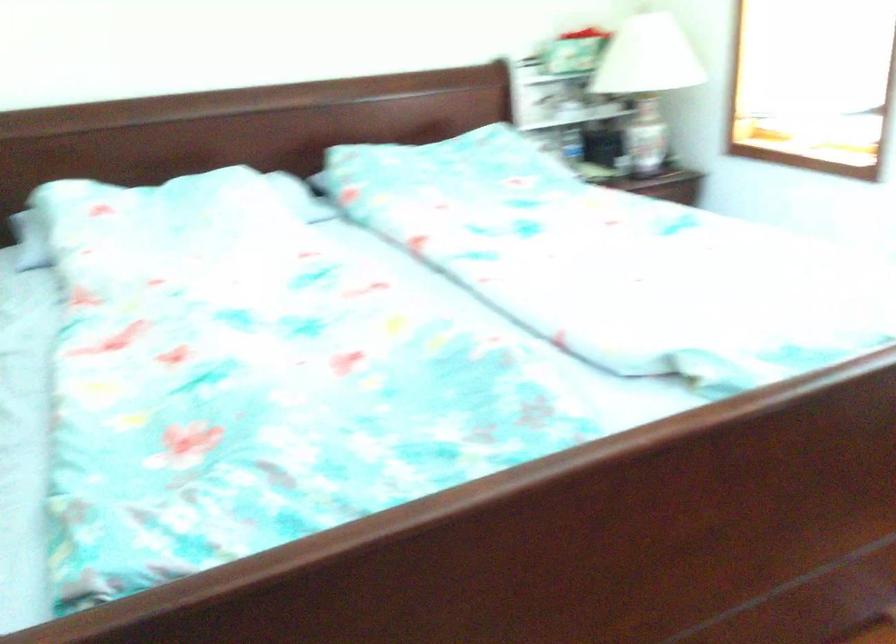
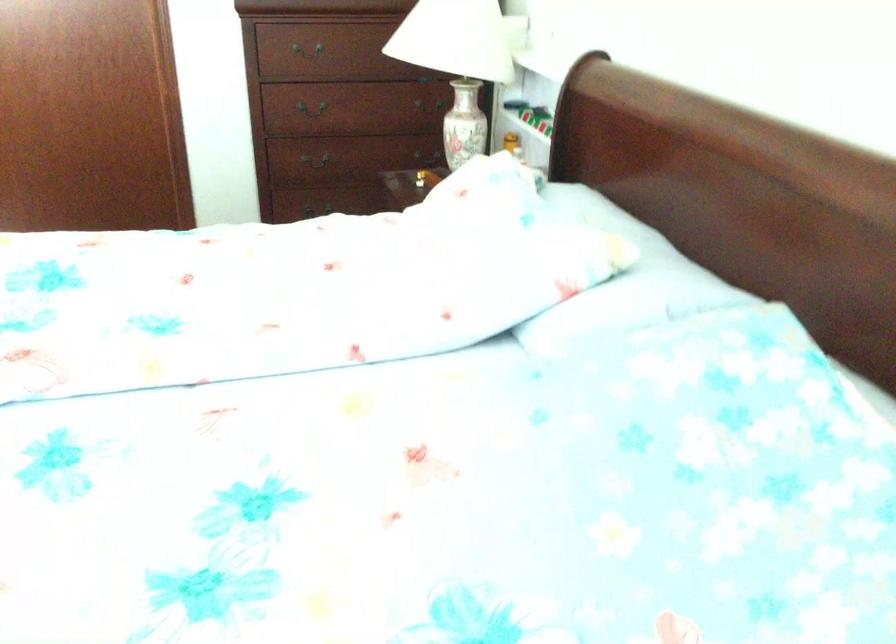
The point at [186,201] is marked in the first image. Where is the corresponding point in the second image?

(618, 275)